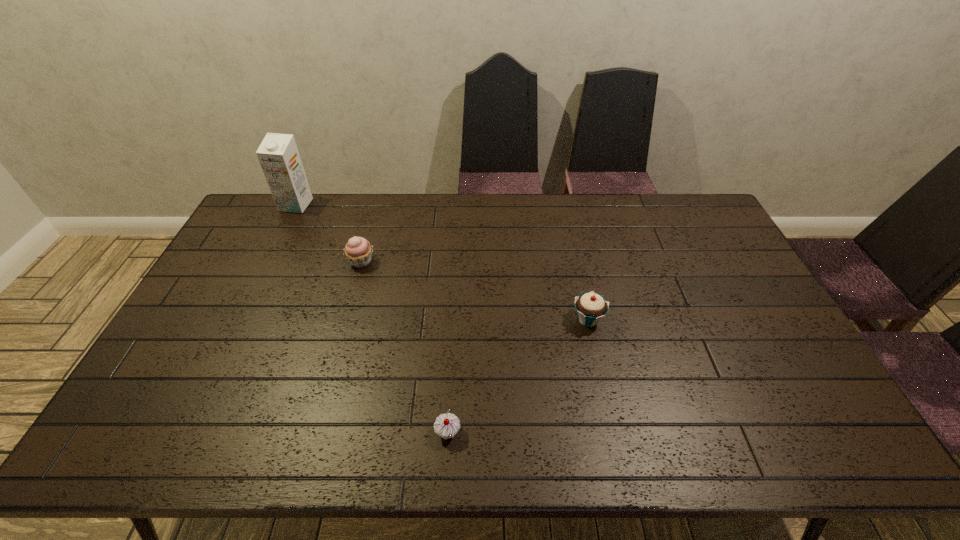
The width and height of the screenshot is (960, 540). Identify the location of vacant area situated on the right of the second nearest object. (694, 319).

In order to click on free space located 0.320m on the left of the nearest cupcake in this screenshot , I will do `click(300, 433)`.

This screenshot has width=960, height=540. What are the coordinates of `object present at the far edge` in the screenshot? It's located at (278, 155).

This screenshot has width=960, height=540. In order to click on object that is at the near edge in this screenshot , I will do `click(447, 425)`.

The image size is (960, 540). Find the location of `object present at the left edge`. object present at the left edge is located at coordinates [278, 155].

Identify the location of object located at the far left corner. (278, 155).

At what (x,y) coordinates should I click in order to perform the action: click on vacant space at the far edge of the desktop. Please return your answer as a coordinate pair (x, y). This screenshot has height=540, width=960. Looking at the image, I should click on (624, 224).

The width and height of the screenshot is (960, 540). In order to click on free spot at the near edge of the desktop in this screenshot , I will do `click(350, 447)`.

The height and width of the screenshot is (540, 960). In the image, there is a desktop. In order to click on vacant space at the left edge in this screenshot , I will do `click(240, 319)`.

I want to click on blank space at the right edge of the desktop, so click(x=768, y=416).